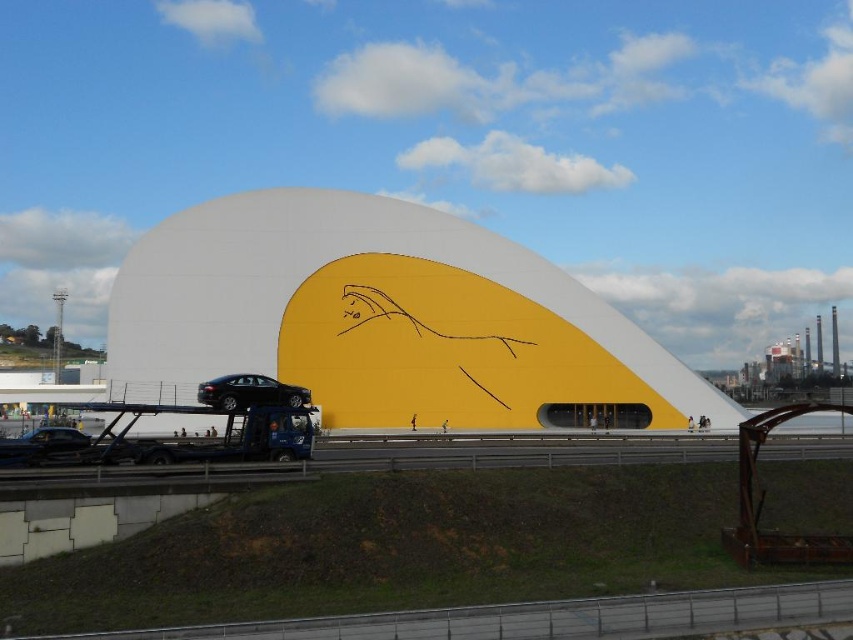
You are driving a car and you see the glossy black car at center and the shiny black car at lower left. Which car is closer to you?

The glossy black car at center is closer to you because the shiny black car at lower left is behind it.

Where is the white matte dome at center located in the image?

The white matte dome at center is located at point coordinates of approximately (381, 317).

You are a delivery driver who needs to park your glossy black car at center in a spot that requires clearance of at least 3 meters. Given the white matte dome at center is above your car, do you think you can park there?

The white matte dome at center is above the glossy black car at center, so there is sufficient vertical clearance to park the glossy black car at center as long as the height of the dome allows for the required 3 meters of clearance. However, you should verify the actual height measurements before proceeding.